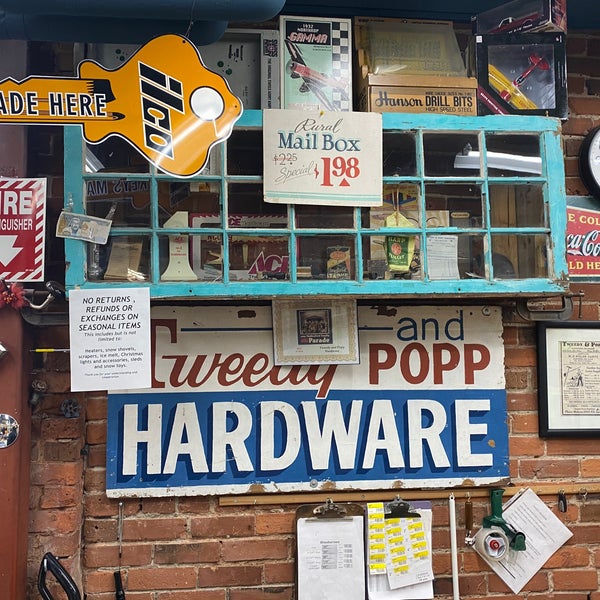
This screenshot has width=600, height=600. Find the location of `brick wall`. brick wall is located at coordinates 223,561.